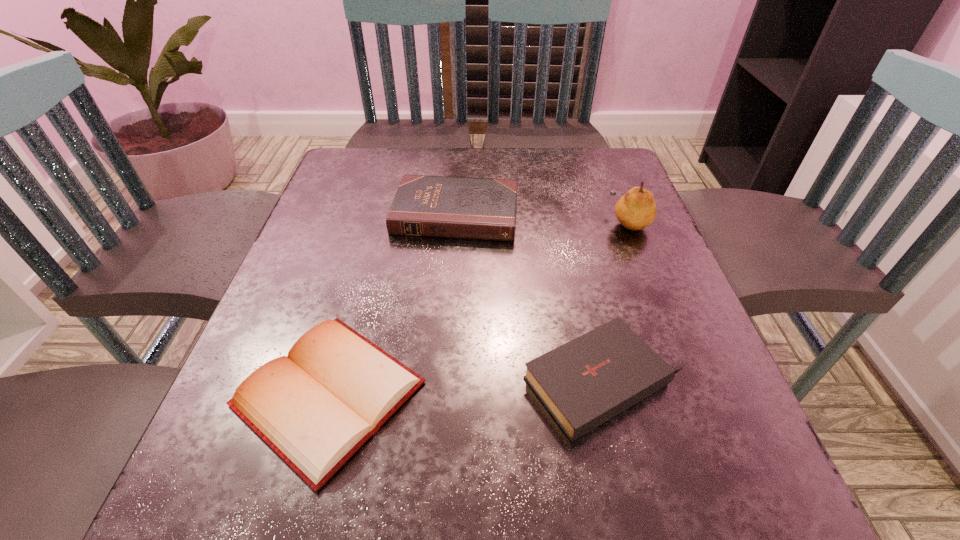
Where is `pear`? This screenshot has width=960, height=540. pear is located at coordinates (636, 210).

This screenshot has height=540, width=960. Identify the location of the farthest Bible. (430, 206).

Identify the location of the shortest Bible. (315, 407).

Image resolution: width=960 pixels, height=540 pixels. I want to click on free location located 0.130m on the back of the tallest object, so 612,177.

Image resolution: width=960 pixels, height=540 pixels. I want to click on free space located 0.150m on the right of the farthest Bible, so click(584, 214).

At what (x,y) coordinates should I click in order to perform the action: click on vacant space located 0.310m on the right of the shortest object. Please return your answer as a coordinate pair (x, y). This screenshot has height=540, width=960. Looking at the image, I should click on (625, 394).

Locate an element on the screen. object situated at the far edge is located at coordinates (430, 206).

Identify the location of object that is at the near edge. The width and height of the screenshot is (960, 540). (315, 407).

In order to click on object situated at the left edge in this screenshot , I will do `click(315, 407)`.

Locate an element on the screen. The image size is (960, 540). pear that is at the right edge is located at coordinates (636, 210).